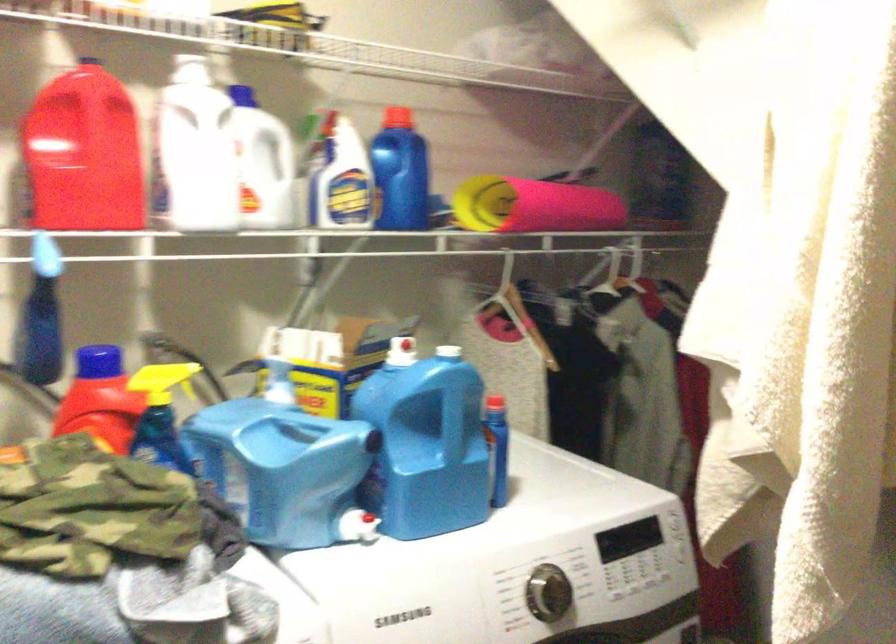
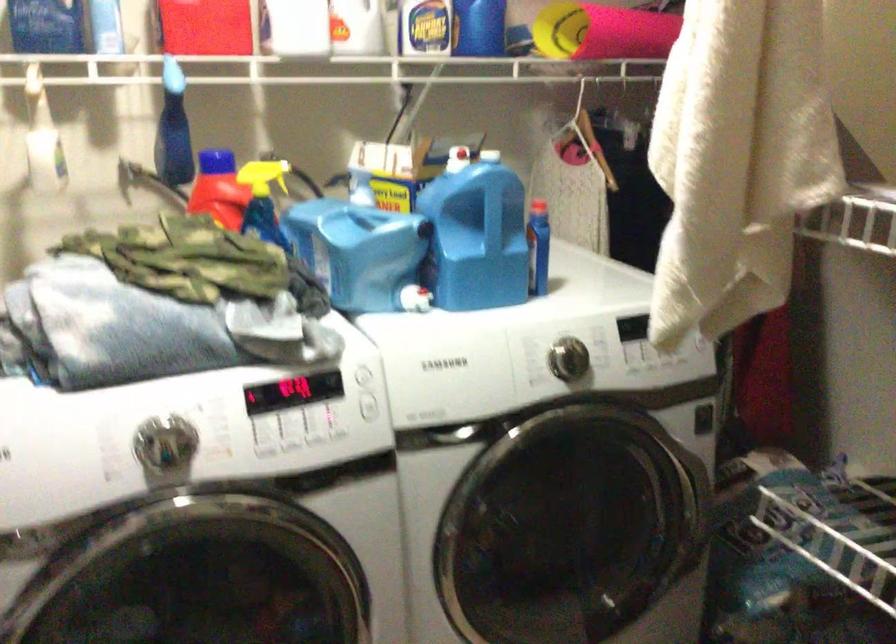
Question: I am providing you with two images of the same scene from different viewpoints. Which of the following objects are not visible in image2?

Choices:
 (A) rolled pink mat
 (B) red spray bottle trigger
 (C) blue spray bottle trigger
 (D) none of these

Answer: (D)